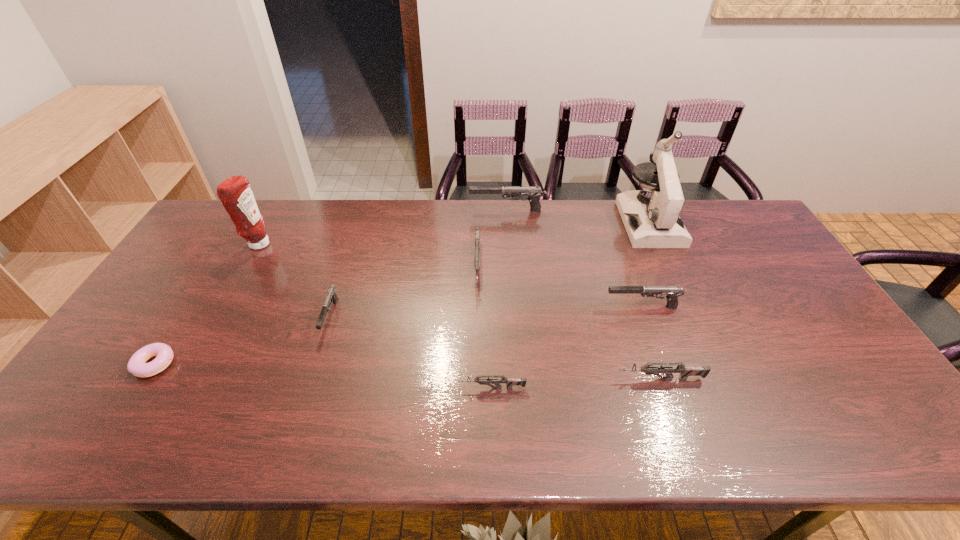
In order to click on vacant space that's between the farthest gun and the second nearest gun in this screenshot , I will do `click(584, 295)`.

I want to click on free space that is in between the biggest grey gun and the smallest grey gun, so click(485, 328).

I want to click on free spot between the rightmost grey gun and the rightmost gray gun, so click(x=651, y=343).

Where is `unoccupied position between the microscope and the rightmost gray gun`? unoccupied position between the microscope and the rightmost gray gun is located at coordinates (646, 265).

Find the location of a particular element. The height and width of the screenshot is (540, 960). unoccupied position between the second biggest gray gun and the condiment is located at coordinates (450, 275).

Find the location of `vacant area between the shortest gun and the tallest object`. vacant area between the shortest gun and the tallest object is located at coordinates (571, 305).

Where is `free space between the tallest object and the rightmost gray gun`? The height and width of the screenshot is (540, 960). free space between the tallest object and the rightmost gray gun is located at coordinates (646, 265).

Find the location of `free point between the second tallest object and the biggest grey gun`. free point between the second tallest object and the biggest grey gun is located at coordinates (368, 256).

The image size is (960, 540). In order to click on unoccupied position between the leftmost object and the second tallest object in this screenshot , I will do `click(206, 304)`.

Point out which object is positioned as the sixth nearest to the purple doughnut. Please provide its 2D coordinates. Your answer should be formatted as a tuple, i.e. [(x, y)], where the tuple contains the x and y coordinates of a point satisfying the conditions above.

[(685, 371)]